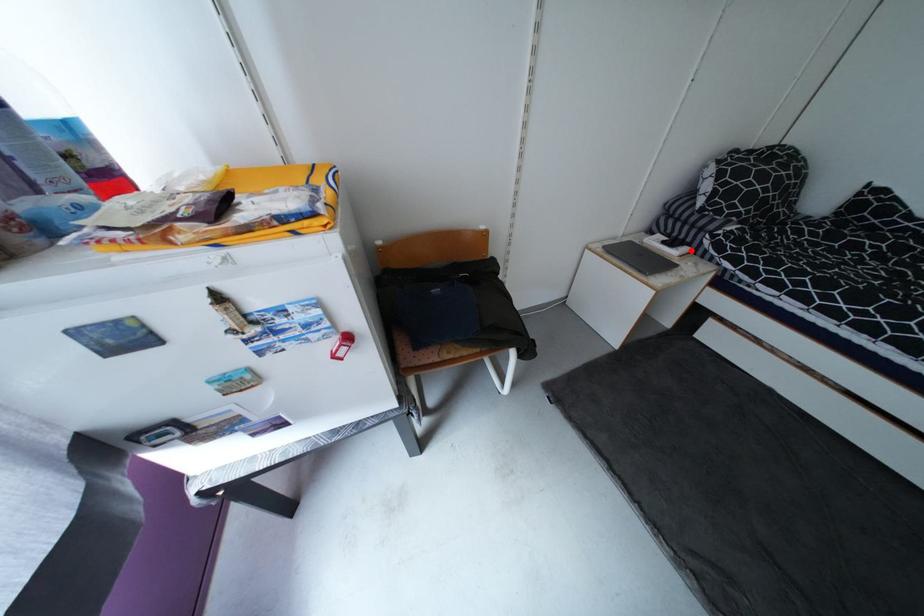
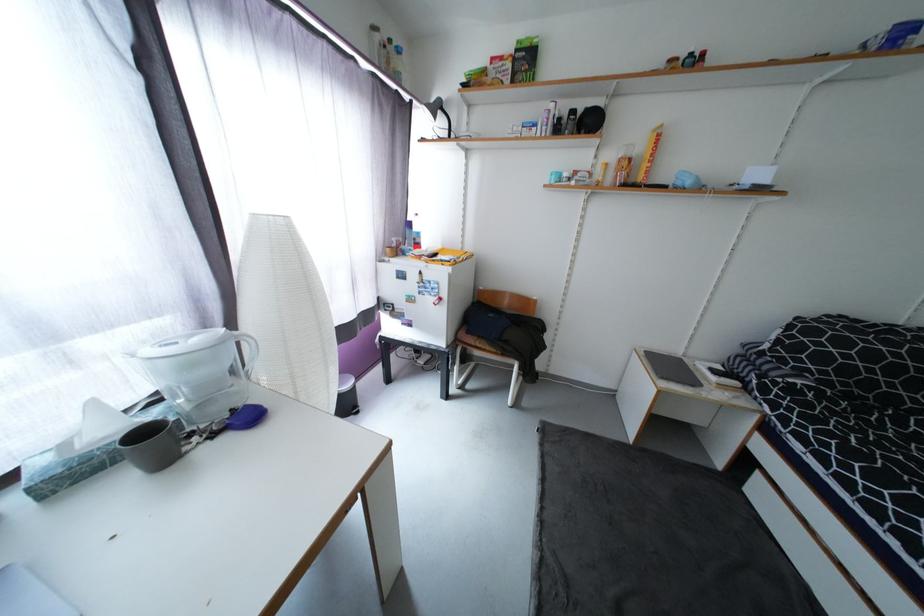
In the second image, find the point that corresponds to the highlighted location in the first image.

(740, 385)